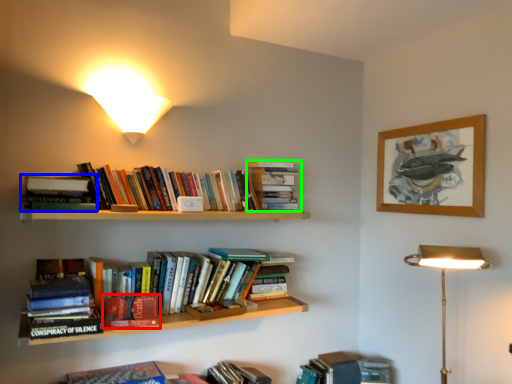
Question: Which object is positioned closest to book (highlighted by a red box)? Select from book (highlighted by a blue box) and book (highlighted by a green box).

Choices:
 (A) book
 (B) book

Answer: (A)